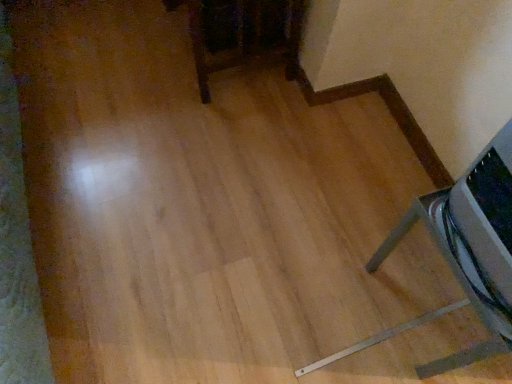
Find the location of a particular element. Image resolution: width=512 pixels, height=384 pixels. free space to the back side of metallic silver speaker at lower right, placed as the second furniture when sorted from left to right is located at coordinates (385, 199).